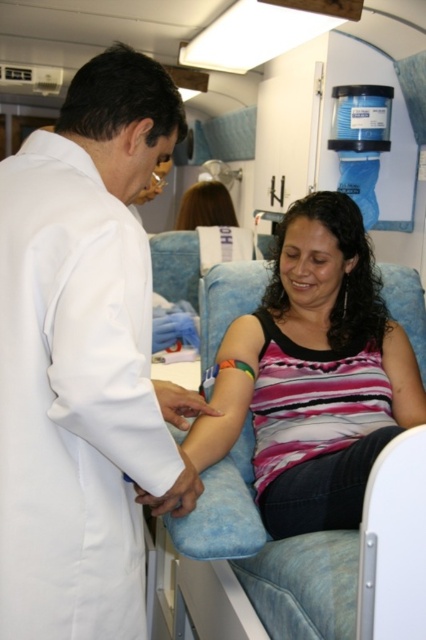
Question: Considering the real-world distances, which object is farthest from the shiny brown hair at upper center?

Choices:
 (A) pink striped tank top at center
 (B) white smooth lab coat at left

Answer: (B)

Question: Which point is closer to the camera?

Choices:
 (A) (299, 465)
 (B) (213, 209)
 (C) (103, 476)

Answer: (C)

Question: Is white smooth lab coat at left to the right of shiny brown hair at upper center from the viewer's perspective?

Choices:
 (A) no
 (B) yes

Answer: (A)

Question: Based on their relative distances, which object is farther from the pink striped tank top at center?

Choices:
 (A) white smooth lab coat at left
 (B) shiny brown hair at upper center

Answer: (B)

Question: Does white smooth lab coat at left appear over pink striped tank top at center?

Choices:
 (A) no
 (B) yes

Answer: (B)

Question: Does pink striped tank top at center have a larger size compared to shiny brown hair at upper center?

Choices:
 (A) no
 (B) yes

Answer: (B)